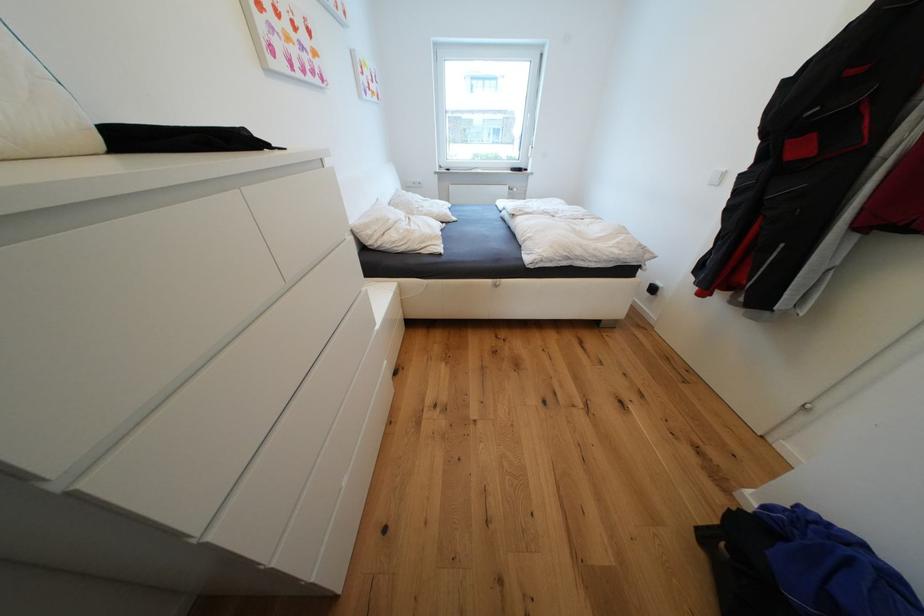
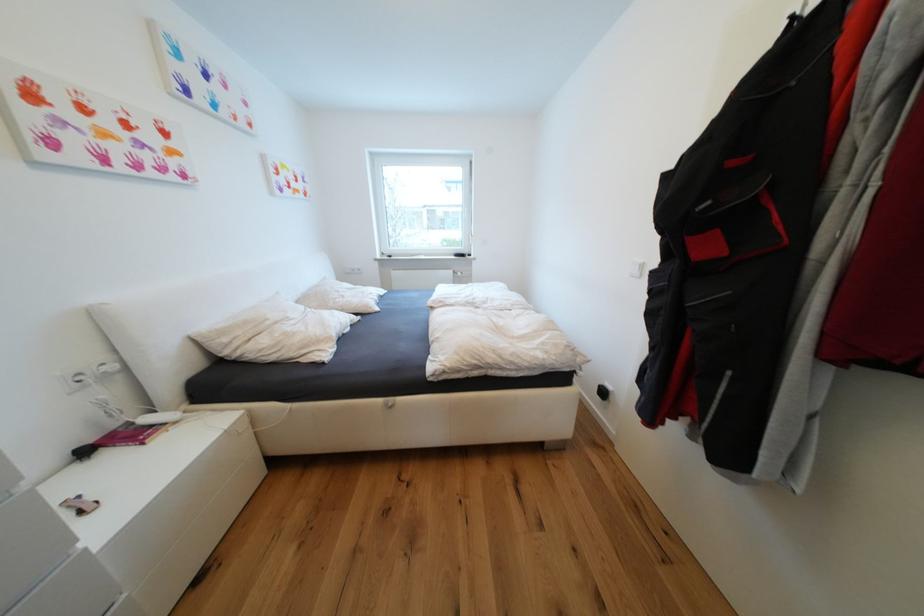
In the second image, find the point that corresponds to (x=808, y=151) in the first image.

(714, 249)